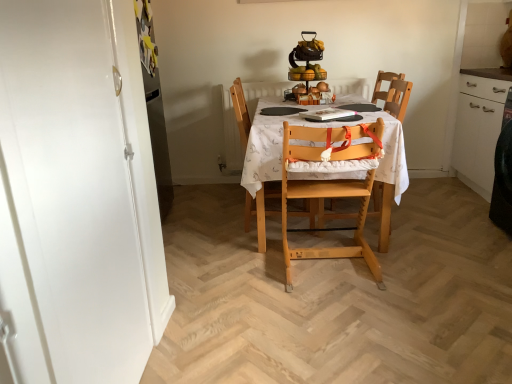
Question: From a real-world perspective, is light wood highchair at center, acting as the 2th chair starting from the right, located higher than white printed fabric at center?

Choices:
 (A) no
 (B) yes

Answer: (B)

Question: From the image's perspective, is light wood highchair at center, which is counted as the second chair, starting from the left, above white printed fabric at center?

Choices:
 (A) yes
 (B) no

Answer: (B)

Question: From the image's perspective, is light wood highchair at center, which is counted as the second chair, starting from the left, below white printed fabric at center?

Choices:
 (A) yes
 (B) no

Answer: (A)

Question: Is light wood highchair at center, which is counted as the second chair, starting from the left, closer to the viewer compared to white printed fabric at center?

Choices:
 (A) yes
 (B) no

Answer: (A)

Question: Is there a large distance between light wood highchair at center, acting as the 2th chair starting from the right, and white printed fabric at center?

Choices:
 (A) no
 (B) yes

Answer: (A)

Question: In terms of size, does white printed fabric at center appear bigger or smaller than wooden highchair at center, arranged as the third chair when viewed from the left?

Choices:
 (A) big
 (B) small

Answer: (A)

Question: Relative to wooden highchair at center, arranged as the third chair when viewed from the left, is white printed fabric at center in front or behind?

Choices:
 (A) front
 (B) behind

Answer: (A)

Question: Is point (257, 173) positioned closer to the camera than point (391, 74)?

Choices:
 (A) closer
 (B) farther

Answer: (A)

Question: Considering the relative positions of white printed fabric at center and wooden highchair at center, marked as the first chair in a right-to-left arrangement, in the image provided, is white printed fabric at center to the left or to the right of wooden highchair at center, marked as the first chair in a right-to-left arrangement,?

Choices:
 (A) right
 (B) left

Answer: (B)

Question: Choose the correct answer: Is wooden chair with cushion at center, the 1th chair in the left-to-right sequence, inside white printed fabric at center or outside it?

Choices:
 (A) inside
 (B) outside

Answer: (A)

Question: From the image's perspective, is wooden chair with cushion at center, acting as the third chair starting from the right, positioned above or below white printed fabric at center?

Choices:
 (A) above
 (B) below

Answer: (A)

Question: Is wooden chair with cushion at center, the 1th chair in the left-to-right sequence, wider or thinner than white printed fabric at center?

Choices:
 (A) wide
 (B) thin

Answer: (B)

Question: Is wooden chair with cushion at center, the 1th chair in the left-to-right sequence, in front of or behind white printed fabric at center in the image?

Choices:
 (A) behind
 (B) front

Answer: (A)

Question: Considering the relative positions of wooden chair with cushion at center, acting as the third chair starting from the right, and light wood highchair at center, which is counted as the second chair, starting from the left, in the image provided, is wooden chair with cushion at center, acting as the third chair starting from the right, to the left or to the right of light wood highchair at center, which is counted as the second chair, starting from the left,?

Choices:
 (A) right
 (B) left

Answer: (B)

Question: In the image, is wooden chair with cushion at center, the 1th chair in the left-to-right sequence, positioned in front of or behind light wood highchair at center, acting as the 2th chair starting from the right?

Choices:
 (A) front
 (B) behind

Answer: (B)